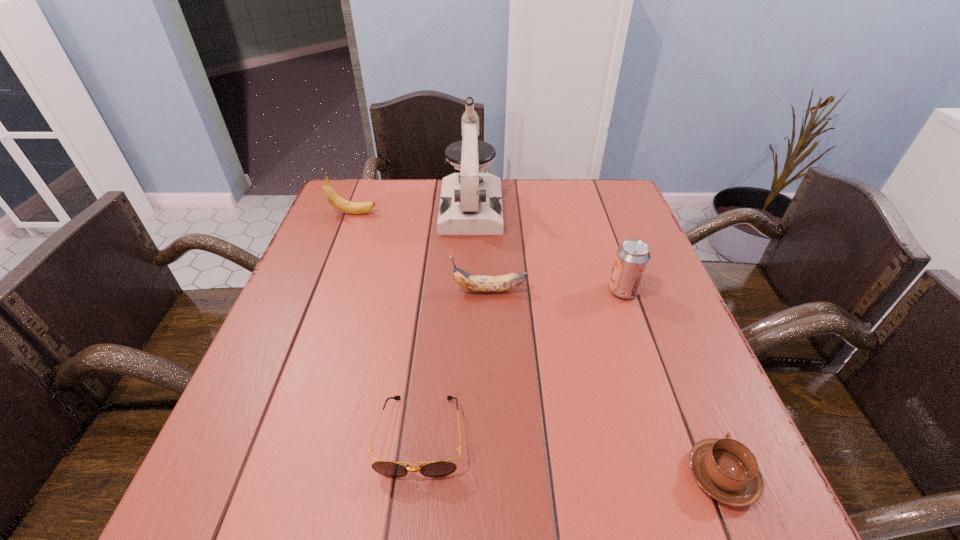
The width and height of the screenshot is (960, 540). I want to click on free spot between the beer can and the third shortest object, so click(x=556, y=291).

Identify the location of free space between the cappuccino and the microscope. The height and width of the screenshot is (540, 960). (596, 342).

The width and height of the screenshot is (960, 540). Identify the location of object that stands as the closest to the cappuccino. (632, 258).

At what (x,y) coordinates should I click in order to perform the action: click on object that is the fifth closest to the taller banana. Please return your answer as a coordinate pair (x, y). Looking at the image, I should click on (727, 470).

The image size is (960, 540). I want to click on vacant point that satisfies the following two spatial constraints: 1. at the start of the peel on the farther banana; 2. on the side of the cappuccino with the handle, so click(253, 475).

Identify the location of free location that satisfies the following two spatial constraints: 1. at the stem of the fourth tallest object; 2. on the side of the cappuccino with the handle. The image size is (960, 540). (493, 475).

Identify the location of free region that satisfies the following two spatial constraints: 1. at the stem of the shorter banana; 2. on the side of the cappuccino with the handle. The image size is (960, 540). (493, 475).

Identify the location of vacant space that satisfies the following two spatial constraints: 1. on the back side of the beer can; 2. at the stem of the nearer banana. The width and height of the screenshot is (960, 540). pos(623,290).